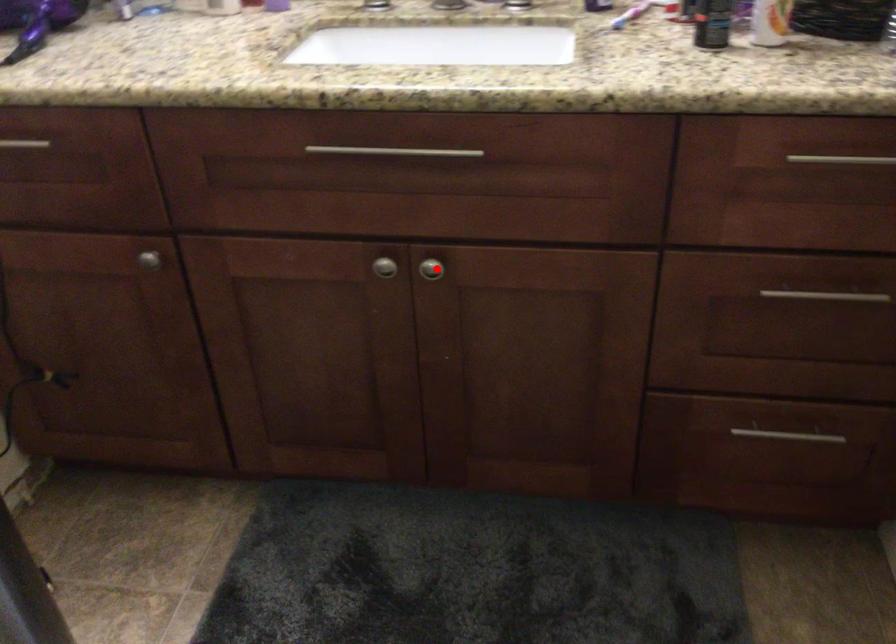
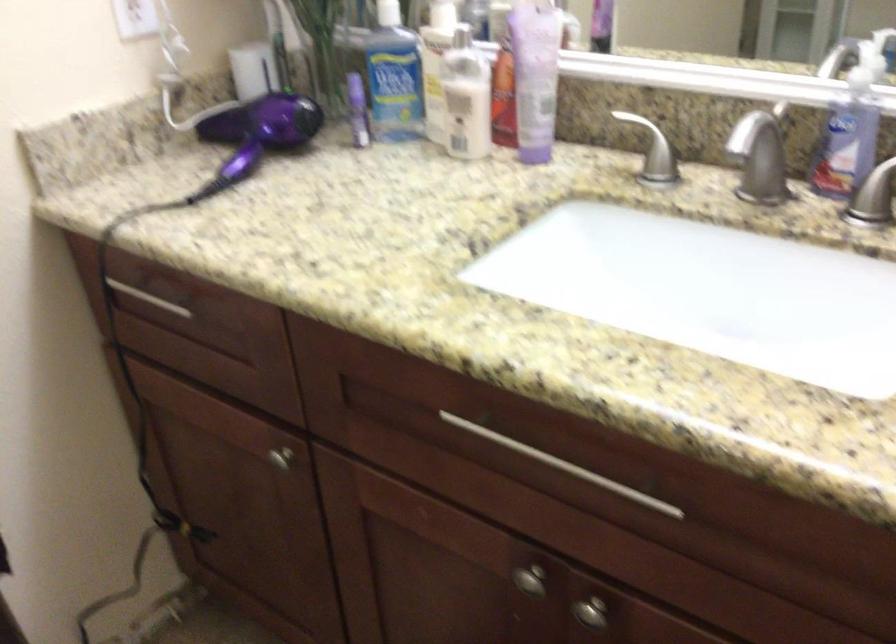
Question: I am providing you with two images of the same scene from different viewpoints. A red point is shown in image1. For the corresponding object point in image2, is it positioned nearer or farther from the camera?

Choices:
 (A) Nearer
 (B) Farther

Answer: (A)